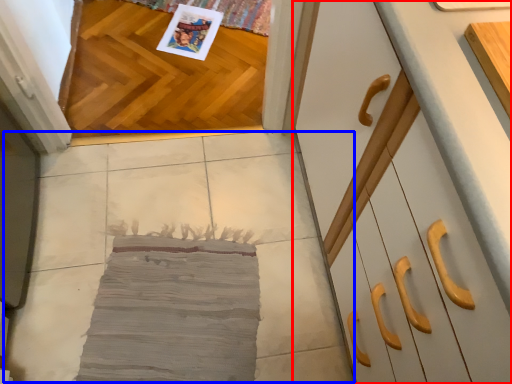
Question: Which object is closer to the camera taking this photo, cabinetry (highlighted by a red box) or concrete (highlighted by a blue box)?

Choices:
 (A) cabinetry
 (B) concrete

Answer: (A)